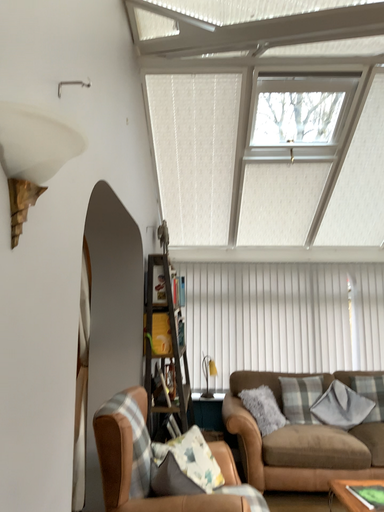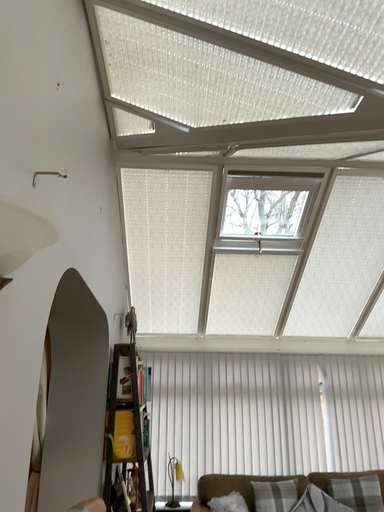
Question: How did the camera likely rotate when shooting the video?

Choices:
 (A) rotated upward
 (B) rotated downward

Answer: (A)